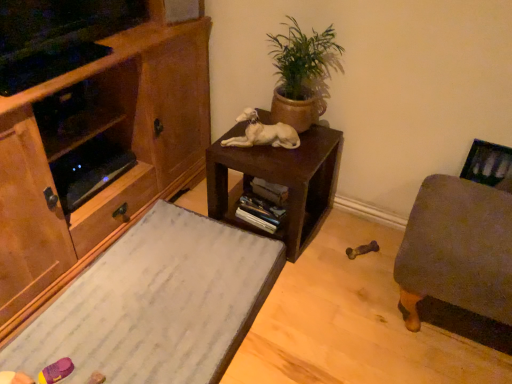
Identify the location of vacant area in front of green matte pot at upper center. (288, 158).